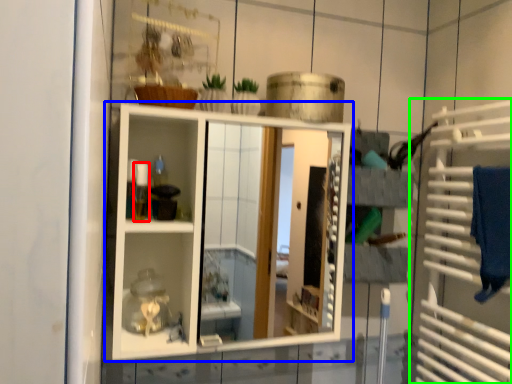
Question: Which object is positioned closest to toiletry (highlighted by a red box)? Select from shelf (highlighted by a blue box) and cage (highlighted by a green box).

Choices:
 (A) shelf
 (B) cage

Answer: (B)